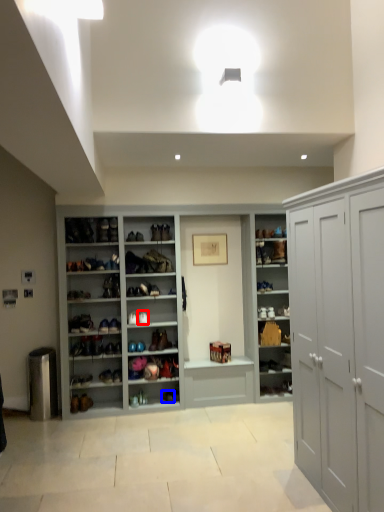
Question: Which object appears closest to the camera in this image, shoe (highlighted by a red box) or shoe (highlighted by a blue box)?

Choices:
 (A) shoe
 (B) shoe

Answer: (A)